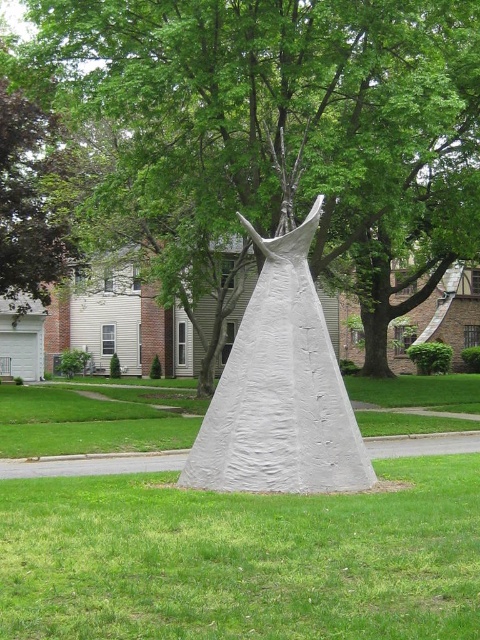
Question: Which point is closer to the camera?

Choices:
 (A) white textured cone at center
 (B) white matte dress at center

Answer: (A)

Question: Based on their relative distances, which object is farther from the white textured cone at center?

Choices:
 (A) white matte dress at center
 (B) green leafy tree at center

Answer: (B)

Question: Estimate the real-world distances between objects in this image. Which object is farther from the white textured cone at center?

Choices:
 (A) green leafy tree at center
 (B) white matte dress at center

Answer: (A)

Question: Can you confirm if green leafy tree at center is positioned above white matte dress at center?

Choices:
 (A) no
 (B) yes

Answer: (B)

Question: Can you confirm if green leafy tree at center is smaller than white matte dress at center?

Choices:
 (A) no
 (B) yes

Answer: (A)

Question: In this image, where is white textured cone at center located relative to white matte dress at center?

Choices:
 (A) above
 (B) below

Answer: (B)